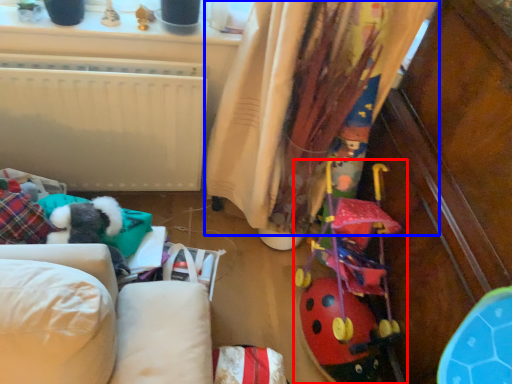
Question: Which point is further to the camera, toy (highlighted by a red box) or curtain (highlighted by a blue box)?

Choices:
 (A) toy
 (B) curtain

Answer: (A)